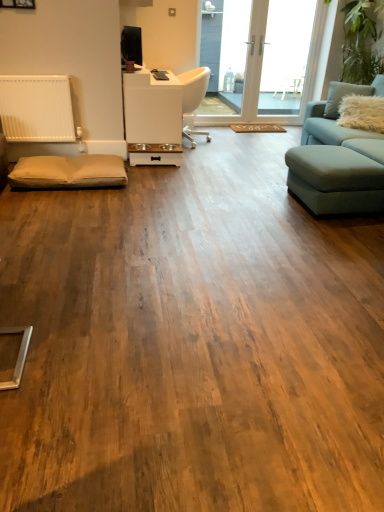
Question: In which direction should I rotate to look at transparent glass door at upper center, placed as the first window screen when sorted from left to right?

Choices:
 (A) left
 (B) right

Answer: (B)

Question: Considering the relative positions of white glossy table at center and fuzzy white pillow at upper right in the image provided, is white glossy table at center to the right of fuzzy white pillow at upper right from the viewer's perspective?

Choices:
 (A) no
 (B) yes

Answer: (A)

Question: Is fuzzy white pillow at upper right located within white glossy table at center?

Choices:
 (A) yes
 (B) no

Answer: (B)

Question: From a real-world perspective, is white glossy table at center below fuzzy white pillow at upper right?

Choices:
 (A) no
 (B) yes

Answer: (B)

Question: Considering the relative positions of white glossy table at center and fuzzy white pillow at upper right in the image provided, is white glossy table at center to the left of fuzzy white pillow at upper right from the viewer's perspective?

Choices:
 (A) no
 (B) yes

Answer: (B)

Question: Is fuzzy white pillow at upper right at the back of white glossy table at center?

Choices:
 (A) no
 (B) yes

Answer: (A)

Question: Is white glossy table at center taller than fuzzy white pillow at upper right?

Choices:
 (A) yes
 (B) no

Answer: (A)

Question: Is white plastic chair at center to the left of transparent glass door at upper center, the second window screen viewed from the right, from the viewer's perspective?

Choices:
 (A) yes
 (B) no

Answer: (A)

Question: Is white plastic chair at center positioned behind transparent glass door at upper center, placed as the first window screen when sorted from left to right?

Choices:
 (A) yes
 (B) no

Answer: (B)

Question: Considering the relative sizes of white plastic chair at center and transparent glass door at upper center, the second window screen viewed from the right, in the image provided, is white plastic chair at center smaller than transparent glass door at upper center, the second window screen viewed from the right,?

Choices:
 (A) yes
 (B) no

Answer: (B)

Question: Considering the relative sizes of white plastic chair at center and transparent glass door at upper center, the second window screen viewed from the right, in the image provided, is white plastic chair at center wider than transparent glass door at upper center, the second window screen viewed from the right,?

Choices:
 (A) no
 (B) yes

Answer: (B)

Question: Could you tell me if white plastic chair at center is turned towards transparent glass door at upper center, placed as the first window screen when sorted from left to right?

Choices:
 (A) no
 (B) yes

Answer: (A)

Question: Considering the relative sizes of white plastic chair at center and transparent glass door at upper center, placed as the first window screen when sorted from left to right, in the image provided, is white plastic chair at center bigger than transparent glass door at upper center, placed as the first window screen when sorted from left to right,?

Choices:
 (A) yes
 (B) no

Answer: (A)

Question: Is the depth of beige fabric footrest at lower left greater than that of fuzzy white pillow at upper right?

Choices:
 (A) yes
 (B) no

Answer: (B)